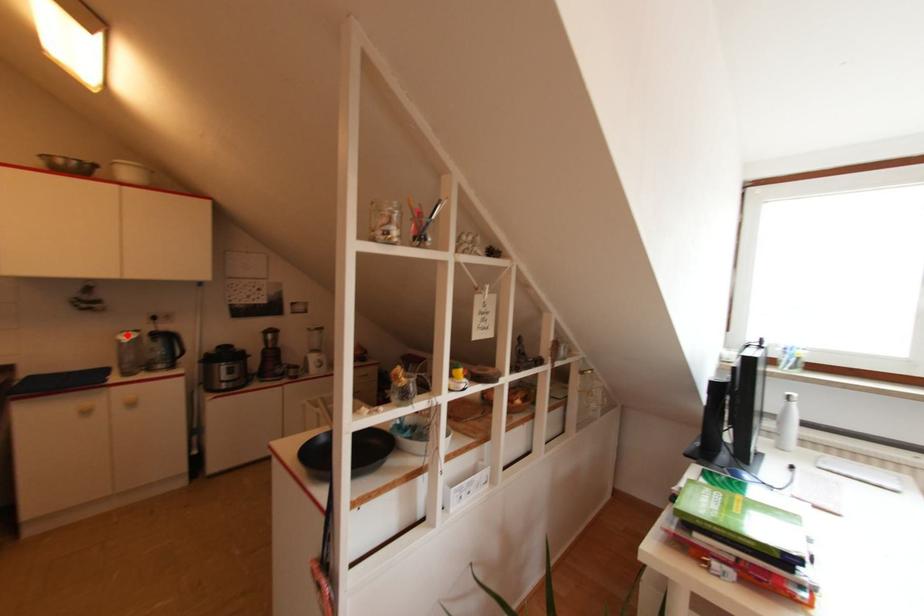
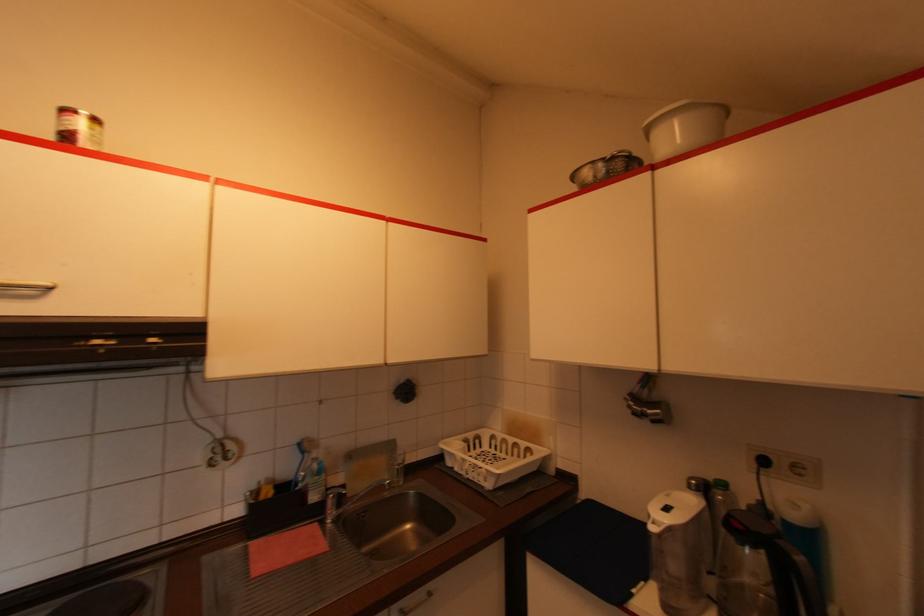
Locate, in the second image, the point that corresponds to the highlighted location in the first image.

(666, 511)